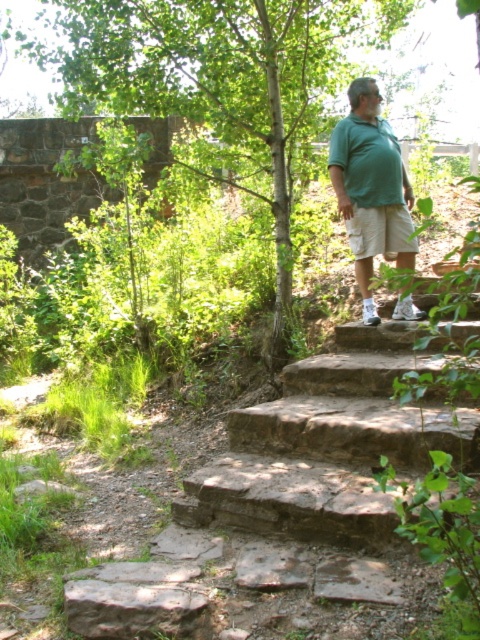
You are a hiker trying to reach the green cotton shirt at upper right from the brown stone stairs at upper center. Are the stairs above or below the shirt?

The brown stone stairs at upper center is located below the green cotton shirt at upper right, so the stairs are below the shirt. To reach the shirt, you would need to go upwards from the stairs.

Looking at this image, you are standing on the brown rough stone at lower left and want to climb up to the brown stone stairs at upper center. Which direction should you move towards?

You should move towards the right direction because the brown stone stairs at upper center is to the right of the brown rough stone at lower left.